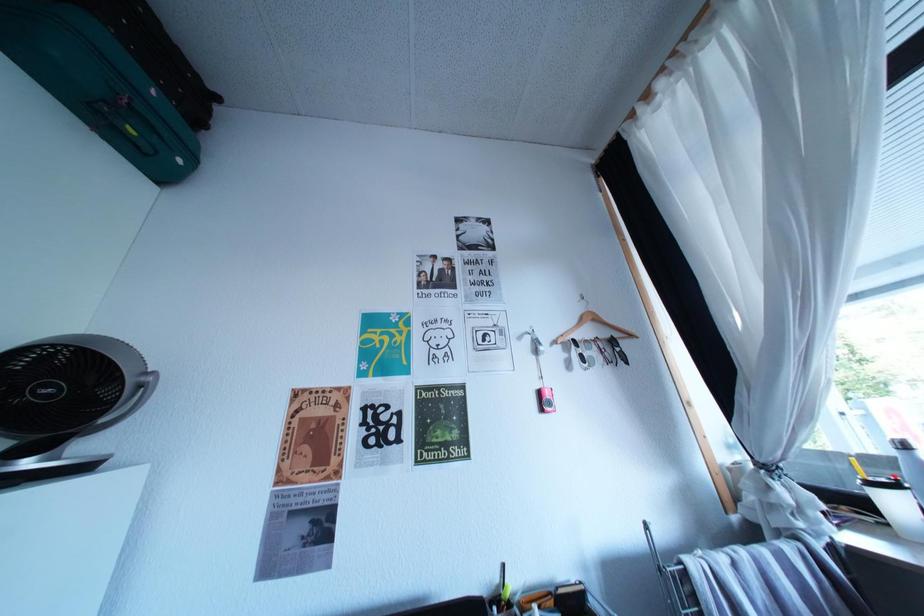
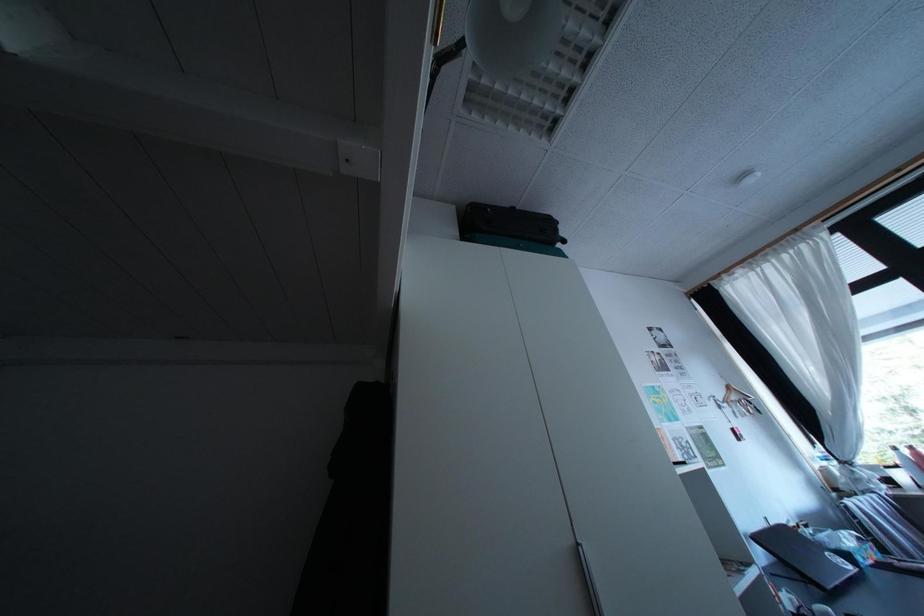
In a continuous first-person perspective shot, in which direction is the camera moving?

The cameraman moved toward left, backward.